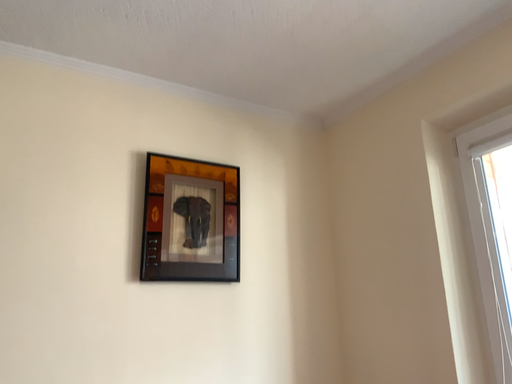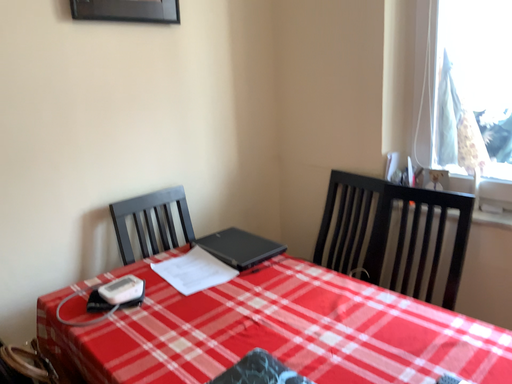
Question: How did the camera likely rotate when shooting the video?

Choices:
 (A) rotated right
 (B) rotated left

Answer: (A)